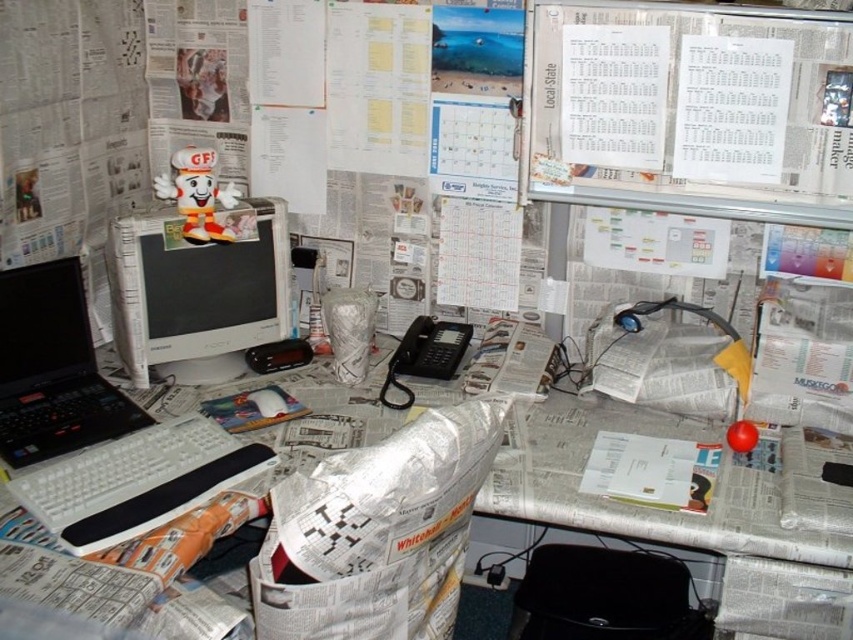
Consider the image. You are trying to find a place to put your coffee cup on the desk. You see the matte plastic computer monitor at left and the black matte laptop at left. Which one is a better option for placing your cup?

The black matte laptop at left is a better option for placing your coffee cup because the matte plastic computer monitor at left is above it, meaning the laptop is lower and likely has a flat surface where the cup can be placed safely without obstructing the monitor.

You are organizing the desk and want to place both the matte plastic computer monitor at left and the white plastic keyboard at lower left on a shelf. The shelf can only hold items that are smaller than 18 inches in width. Which item should you place first to ensure both fit?

The matte plastic computer monitor at left is larger than the white plastic keyboard at lower left. Since the shelf requires items smaller than 18 inches, you should measure both items first. If the monitor is under 18 inches, place it first due to its size, then the keyboard. If either exceeds 18 inches, they won